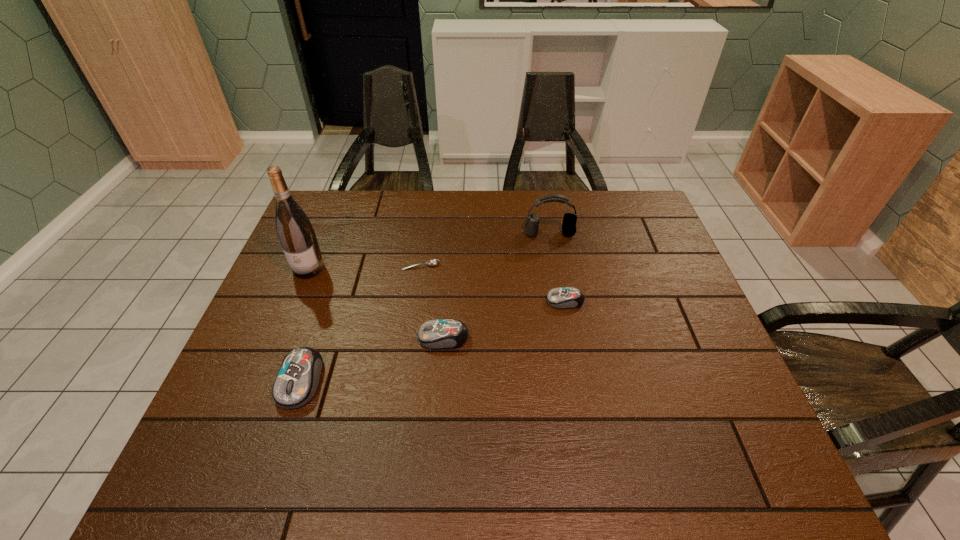
Where is `unoccupied position between the second computer mouse from right to left and the second tallest object`? Image resolution: width=960 pixels, height=540 pixels. unoccupied position between the second computer mouse from right to left and the second tallest object is located at coordinates (496, 286).

Identify which object is the second nearest to the nearest object. Please provide its 2D coordinates. Your answer should be formatted as a tuple, i.e. [(x, y)], where the tuple contains the x and y coordinates of a point satisfying the conditions above.

[(296, 234)]

Find the location of `the fifth closest object to the tallest object`. the fifth closest object to the tallest object is located at coordinates (563, 297).

Identify which computer mouse is located as the second nearest to the shortest object. Please provide its 2D coordinates. Your answer should be formatted as a tuple, i.e. [(x, y)], where the tuple contains the x and y coordinates of a point satisfying the conditions above.

[(563, 297)]

The width and height of the screenshot is (960, 540). In order to click on computer mouse that is the second nearest to the shortest object in this screenshot , I will do `click(563, 297)`.

You are a GUI agent. You are given a task and a screenshot of the screen. Output one action in this format:
    pyautogui.click(x=<x>, y=<y>)
    Task: Click on the vacant position in the image that satisfies the following two spatial constraints: 1. on the wheel side of the rightmost computer mouse; 2. on the wheel side of the fourth shortest object
    The width and height of the screenshot is (960, 540).
    Given the screenshot: What is the action you would take?
    pyautogui.click(x=580, y=381)

Find the location of a particular element. free location that satisfies the following two spatial constraints: 1. on the headband of the headset; 2. on the wheel side of the second computer mouse from left to right is located at coordinates (568, 338).